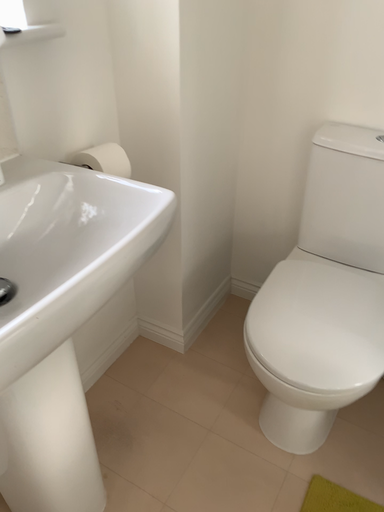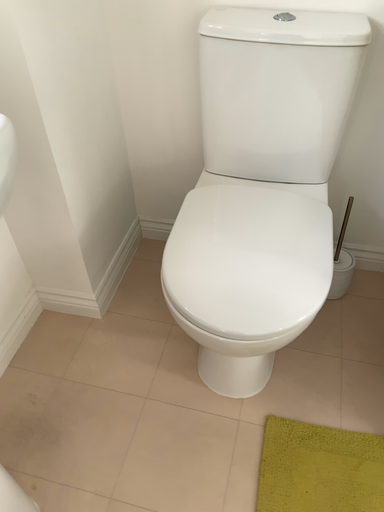
Question: Which way did the camera rotate in the video?

Choices:
 (A) rotated left
 (B) rotated right

Answer: (B)